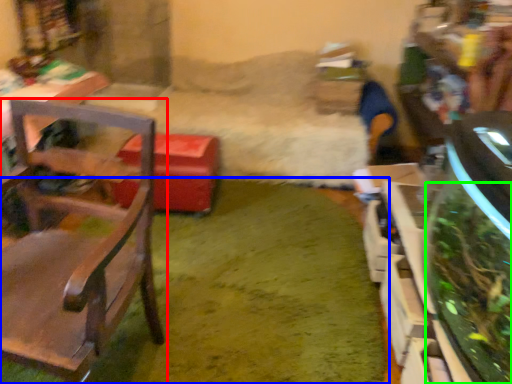
Question: Which object is the closest to the chair (highlighted by a red box)? Choose among these: grass (highlighted by a blue box) or plant (highlighted by a green box).

Choices:
 (A) grass
 (B) plant

Answer: (A)